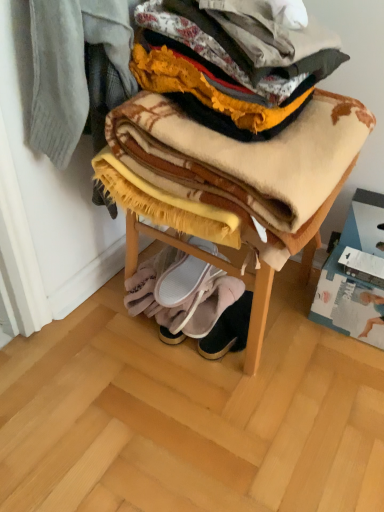
What are the coordinates of `vacant area to the left of white suede slippers at lower center, positioned as the first footwear in top-to-bottom order` in the screenshot? It's located at (155, 264).